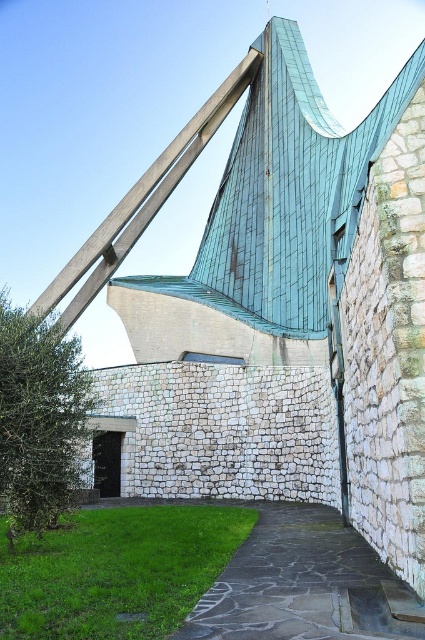
Question: Does paved stone path at lower center come behind green patina metal beam at upper center?

Choices:
 (A) yes
 (B) no

Answer: (B)

Question: Which is nearer to the paved stone path at lower center?

Choices:
 (A) green grass at lower left
 (B) green patina metal beam at upper center

Answer: (A)

Question: Considering the relative positions of green grass at lower left and paved stone path at lower center in the image provided, where is green grass at lower left located with respect to paved stone path at lower center?

Choices:
 (A) above
 (B) below

Answer: (B)

Question: Which object is positioned closest to the paved stone path at lower center?

Choices:
 (A) green grass at lower left
 (B) green patina metal beam at upper center

Answer: (A)

Question: Considering the relative positions of green grass at lower left and green patina metal beam at upper center in the image provided, where is green grass at lower left located with respect to green patina metal beam at upper center?

Choices:
 (A) above
 (B) below

Answer: (B)

Question: Estimate the real-world distances between objects in this image. Which object is farther from the green grass at lower left?

Choices:
 (A) green patina metal beam at upper center
 (B) paved stone path at lower center

Answer: (A)